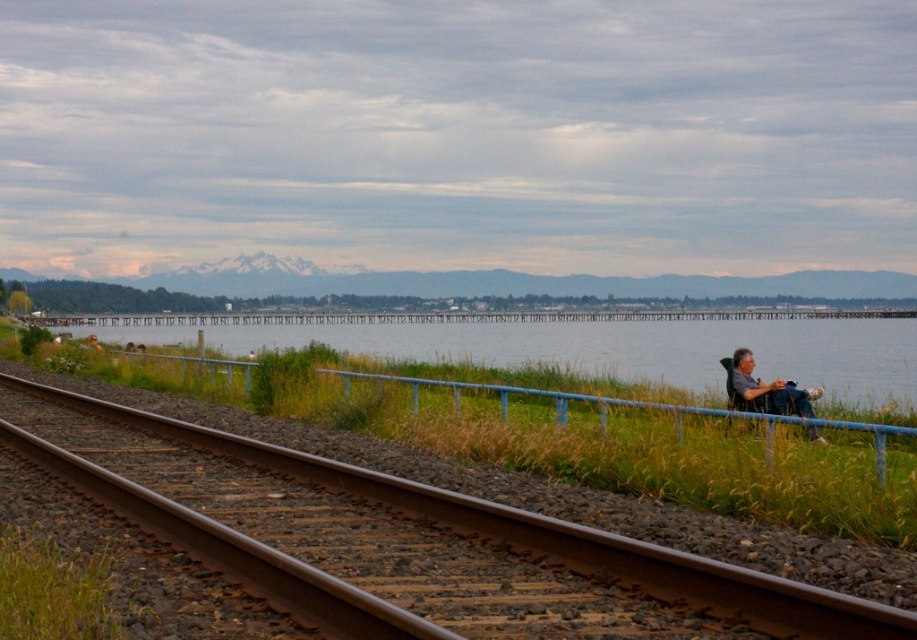
Which is more to the left, brown metal track at lower left or clear blue water at center?

From the viewer's perspective, brown metal track at lower left appears more on the left side.

Can you confirm if brown metal track at lower left is positioned below clear blue water at center?

Indeed, brown metal track at lower left is positioned under clear blue water at center.

This screenshot has width=917, height=640. What do you see at coordinates (447, 524) in the screenshot? I see `brown metal track at lower left` at bounding box center [447, 524].

Where is `brown metal track at lower left`? The width and height of the screenshot is (917, 640). brown metal track at lower left is located at coordinates (447, 524).

Does green grass at lower left appear under gray fabric chair at right?

Correct, green grass at lower left is located below gray fabric chair at right.

Is green grass at lower left smaller than gray fabric chair at right?

Yes.

Between point (89, 616) and point (739, 403), which one is positioned in front?

Point (89, 616) is in front.

Locate an element on the screen. green grass at lower left is located at coordinates (52, 588).

Based on the photo, is clear blue water at center positioned before gray fabric chair at right?

No, it is not.

What do you see at coordinates (605, 348) in the screenshot? I see `clear blue water at center` at bounding box center [605, 348].

Is point (686, 369) in front of point (738, 381)?

No, (686, 369) is behind (738, 381).

Locate an element on the screen. This screenshot has height=640, width=917. clear blue water at center is located at coordinates (605, 348).